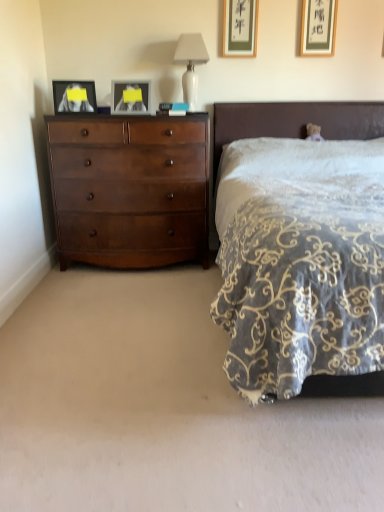
Question: Is point (147, 96) closer or farther from the camera than point (231, 25)?

Choices:
 (A) closer
 (B) farther

Answer: (A)

Question: From a real-world perspective, relative to matte gold picture frame at upper center, which is the 2th picture frame in right-to-left order, is matte glass picture frame at upper center, marked as the 2th picture frame in a left-to-right arrangement, vertically above or below?

Choices:
 (A) below
 (B) above

Answer: (A)

Question: Considering the real-world distances, which object is farthest from the matte black picture frame at left, marked as the 4th picture frame in a right-to-left arrangement?

Choices:
 (A) velvet dark brown bed at right
 (B) shiny brown dresser at left
 (C) matte glass picture frame at upper center, the third picture frame viewed from the right
 (D) white ceramic table lamp at upper center
 (E) matte gold picture frame at upper center, which is the 2th picture frame in right-to-left order

Answer: (E)

Question: Estimate the real-world distances between objects in this image. Which object is farther from the white ceramic table lamp at upper center?

Choices:
 (A) matte glass picture frame at upper center, the third picture frame viewed from the right
 (B) matte gold picture frame at upper right, which is the 4th picture frame in left-to-right order
 (C) matte black picture frame at left, marked as the 4th picture frame in a right-to-left arrangement
 (D) velvet dark brown bed at right
 (E) shiny brown dresser at left

Answer: (E)